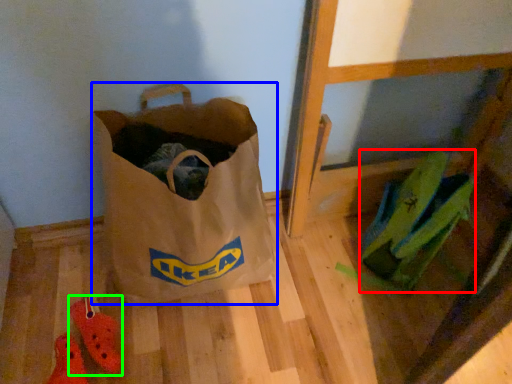
Question: Considering the real-world distances, which object is farthest from grocery bag (highlighted by a red box)? luggage and bags (highlighted by a blue box) or footwear (highlighted by a green box)?

Choices:
 (A) luggage and bags
 (B) footwear

Answer: (B)